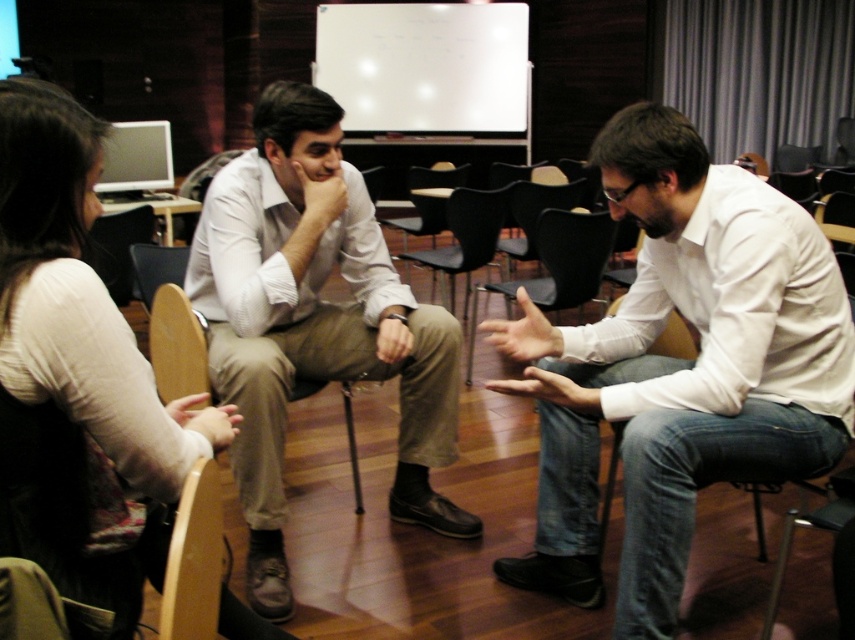
Can you confirm if white matte shirt at center is bigger than smooth skin hand at center?

Yes, white matte shirt at center is bigger than smooth skin hand at center.

In the scene shown: Is white matte shirt at center below smooth skin hand at center?

Yes, white matte shirt at center is below smooth skin hand at center.

Is point (826, 273) positioned after point (516, 349)?

No, (826, 273) is closer to viewer.

Find the location of a particular element. This screenshot has height=640, width=855. white matte shirt at center is located at coordinates (684, 369).

Between point (152, 419) and point (221, 419), which one is positioned behind?

The point (221, 419) is more distant.

Where is `matte white shirt at upper left`? The width and height of the screenshot is (855, 640). matte white shirt at upper left is located at coordinates (74, 372).

Where is `matte white shirt at upper left`? matte white shirt at upper left is located at coordinates (74, 372).

Can you confirm if white matte shirt at center is shorter than matte khaki pants at center?

Yes.

Between point (747, 179) and point (225, 172), which one is positioned in front?

Point (747, 179) is in front.

Is point (806, 417) in front of point (246, 241)?

Yes.

What are the coordinates of `white matte shirt at center` in the screenshot? It's located at (684, 369).